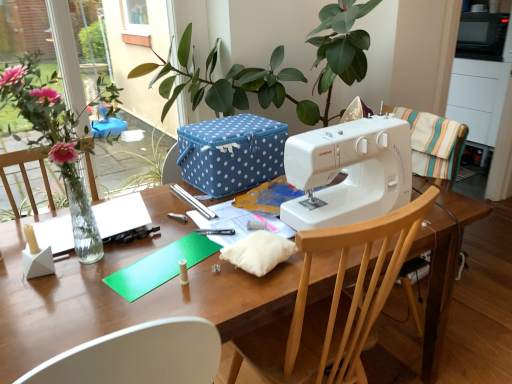
Question: From a real-world perspective, is white plastic sewing machine at center beneath blue polka dot fabric box at center?

Choices:
 (A) no
 (B) yes

Answer: (A)

Question: Is white plastic sewing machine at center oriented away from blue polka dot fabric box at center?

Choices:
 (A) yes
 (B) no

Answer: (A)

Question: Considering the relative sizes of white plastic sewing machine at center and blue polka dot fabric box at center in the image provided, is white plastic sewing machine at center shorter than blue polka dot fabric box at center?

Choices:
 (A) yes
 (B) no

Answer: (B)

Question: From a real-world perspective, is white plastic sewing machine at center over blue polka dot fabric box at center?

Choices:
 (A) no
 (B) yes

Answer: (B)

Question: Could you tell me if white plastic sewing machine at center is turned towards blue polka dot fabric box at center?

Choices:
 (A) yes
 (B) no

Answer: (B)

Question: Is white plastic sewing machine at center in contact with blue polka dot fabric box at center?

Choices:
 (A) no
 (B) yes

Answer: (A)

Question: Can you confirm if wooden chair at center, which is counted as the second chair, starting from the top, is positioned to the left of white plastic sewing machine at center?

Choices:
 (A) no
 (B) yes

Answer: (B)

Question: Can you confirm if wooden chair at center, placed as the 1th chair when sorted from left to right, is positioned to the right of white plastic sewing machine at center?

Choices:
 (A) no
 (B) yes

Answer: (A)

Question: Is wooden chair at center, which appears as the second chair when viewed from the right, positioned beyond the bounds of white plastic sewing machine at center?

Choices:
 (A) no
 (B) yes

Answer: (B)

Question: From a real-world perspective, is wooden chair at center, which appears as the second chair when viewed from the right, located higher than white plastic sewing machine at center?

Choices:
 (A) no
 (B) yes

Answer: (A)

Question: Is wooden chair at center, which is counted as the second chair, starting from the top, wider than white plastic sewing machine at center?

Choices:
 (A) no
 (B) yes

Answer: (B)

Question: Are wooden chair at center, which is counted as the second chair, starting from the top, and white plastic sewing machine at center making contact?

Choices:
 (A) no
 (B) yes

Answer: (A)

Question: Does wooden table at center appear on the right side of wooden chair at right, positioned as the second chair in left-to-right order?

Choices:
 (A) no
 (B) yes

Answer: (A)